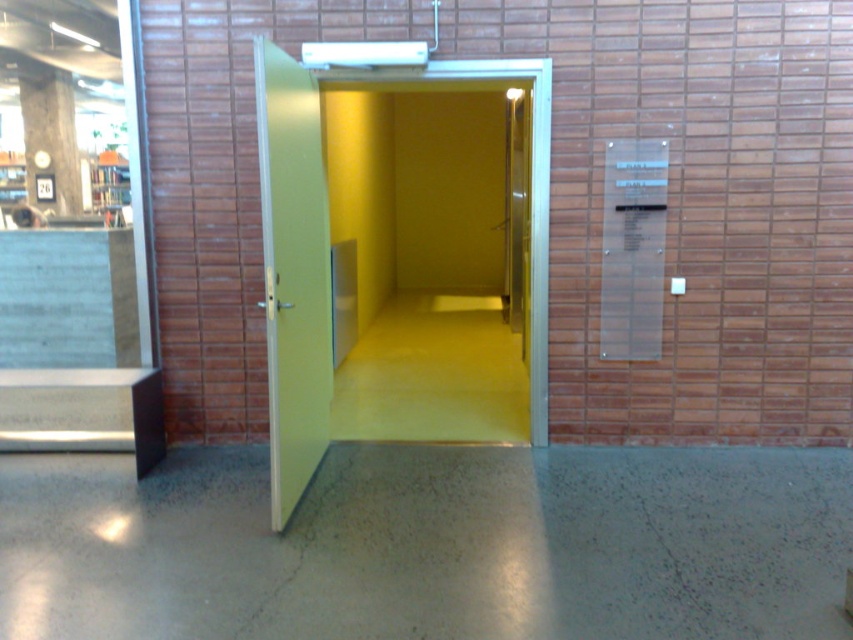
Is point (320, 260) in front of point (292, 460)?

No, it is not.

Is green matte door at center to the left of green matte elevator at center from the viewer's perspective?

Correct, you'll find green matte door at center to the left of green matte elevator at center.

Is point (289, 467) closer to viewer compared to point (276, 275)?

No, it is not.

Identify the location of green matte door at center. (293, 273).

Is green matte elevator at center thinner than concrete at left?

No.

What do you see at coordinates (283, 246) in the screenshot? Image resolution: width=853 pixels, height=640 pixels. I see `green matte elevator at center` at bounding box center [283, 246].

I want to click on green matte elevator at center, so click(x=283, y=246).

Between green matte door at center and concrete at left, which one has less height?

concrete at left

This screenshot has width=853, height=640. Identify the location of green matte door at center. (293, 273).